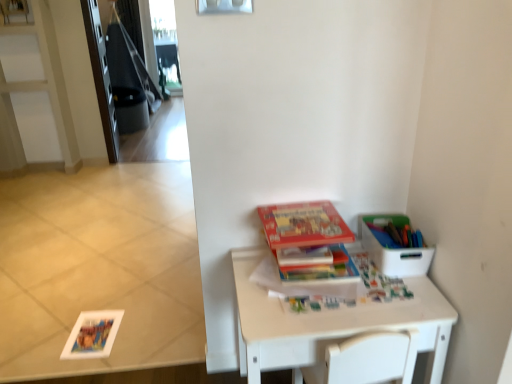
Question: Is white plastic container at right taller or shorter than hardcover book at center, which is the 1th paperback book in bottom-to-top order?

Choices:
 (A) short
 (B) tall

Answer: (B)

Question: Is white plastic container at right in front of or behind hardcover book at center, the 2th paperback book from the top, in the image?

Choices:
 (A) front
 (B) behind

Answer: (A)

Question: Which object is the closest to the matte cardboard book at center, which is counted as the 2th paperback book, starting from the bottom?

Choices:
 (A) white matte table at lower right
 (B) white plastic container at right
 (C) matte plastic container at upper right
 (D) hardcover book at center, the 2th paperback book from the top

Answer: (D)

Question: Estimate the real-world distances between objects in this image. Which object is closer to the matte cardboard book at center, which is counted as the 2th paperback book, starting from the bottom?

Choices:
 (A) white plastic container at right
 (B) hardcover book at center, which is the 1th paperback book in bottom-to-top order
 (C) white matte table at lower right
 (D) matte plastic container at upper right

Answer: (B)